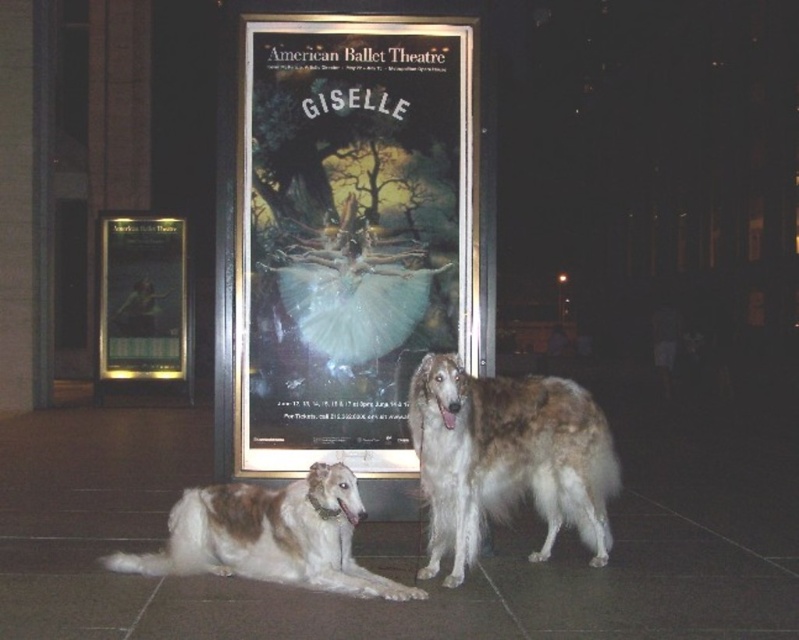
You are standing in a theater lobby and see the white fluffy tutu at center displayed in front of the ballet poster. If you want to take a closer look, how many steps would you need to take to reach it? Assume each step covers 0.75 meters.

The distance between the white fluffy tutu at center and the viewer is 5.62 meters. Since each step covers 0.75 meters, you would need approximately 7 steps to reach it because 5.62 divided by 0.75 is about 7.5, so rounding up to the nearest whole number.

You are a photographer aiming to capture a closeup of the American Ballet Theatre poster while ensuring both the brown and white fur at center and the white fluffy tutu at center are visible in the frame. Given their sizes, which object should you focus on to ensure it fits entirely within the photo?

The brown and white fur at center is larger than the white fluffy tutu at center, so focusing on the brown and white fur at center ensures it fits entirely within the photo.